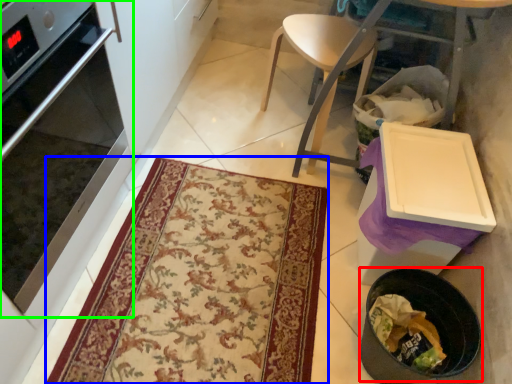
Question: Based on their relative distances, which object is nearer to appliance (highlighted by a red box)? Choose from mat (highlighted by a blue box) and oven (highlighted by a green box).

Choices:
 (A) mat
 (B) oven

Answer: (A)